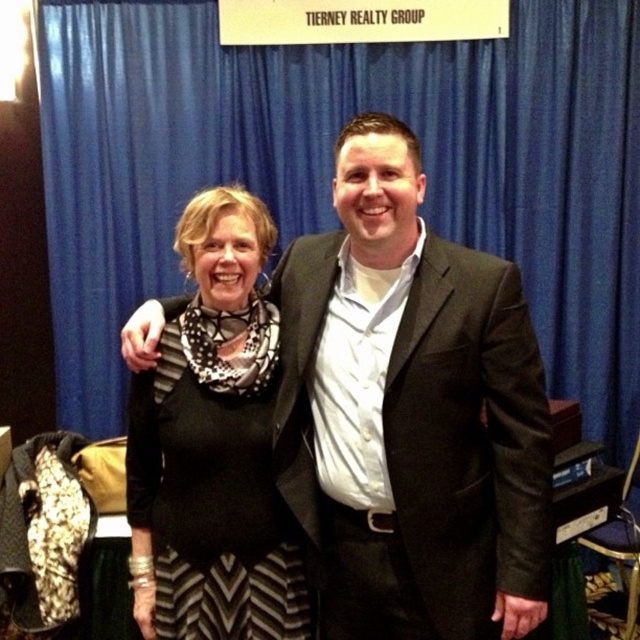
Is black matte suit at center further to the viewer compared to black dotted scarf at center?

No.

Is black matte suit at center smaller than black dotted scarf at center?

No.

Does point (307, 509) lie behind point (168, 464)?

That is False.

Locate an element on the screen. The width and height of the screenshot is (640, 640). black matte suit at center is located at coordinates (410, 412).

Is point (324, 131) positioned in front of point (205, 529)?

No, (324, 131) is behind (205, 529).

The image size is (640, 640). In order to click on blue fabric curtain at upper center in this screenshot , I will do `click(332, 168)`.

Identify the location of blue fabric curtain at upper center. The image size is (640, 640). (332, 168).

Does blue fabric curtain at upper center have a greater height compared to black matte suit at center?

Indeed, blue fabric curtain at upper center has a greater height compared to black matte suit at center.

Between blue fabric curtain at upper center and black matte suit at center, which one appears on the right side from the viewer's perspective?

black matte suit at center is more to the right.

Identify the location of blue fabric curtain at upper center. The height and width of the screenshot is (640, 640). (332, 168).

Where is `blue fabric curtain at upper center`? blue fabric curtain at upper center is located at coordinates (332, 168).